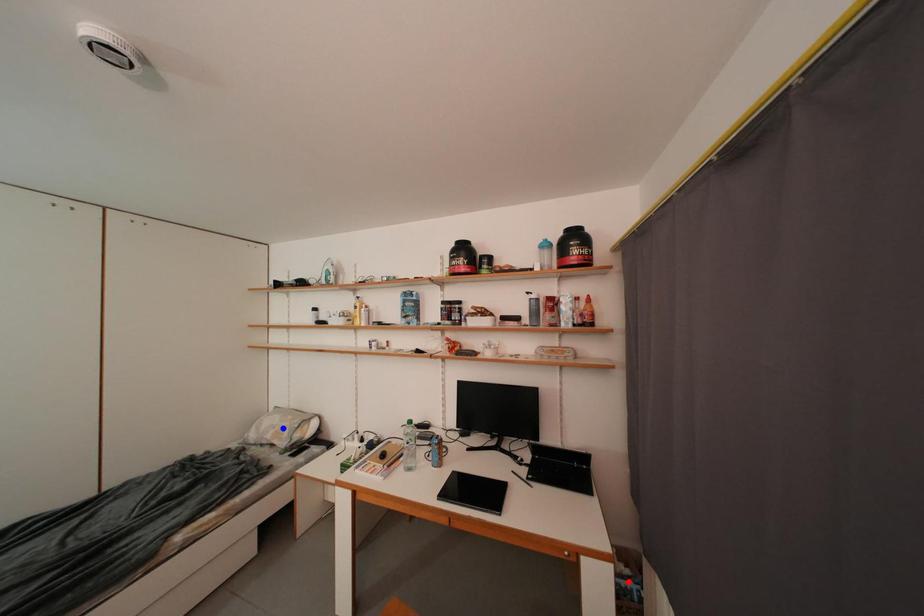
Question: In the image, two points are highlighted. Which point is nearer to the camera? Reply with the corresponding letter.

Choices:
 (A) blue point
 (B) red point

Answer: (B)